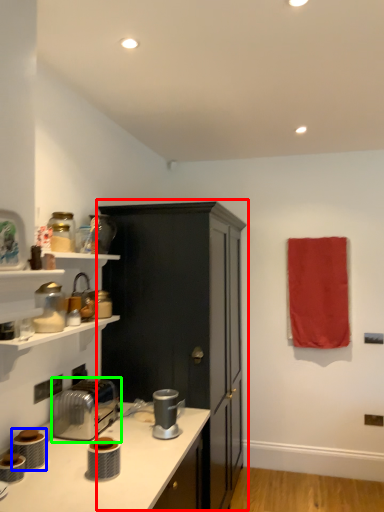
Question: Which is farther away from cabinetry (highlighted by a red box)? appliance (highlighted by a blue box) or toaster (highlighted by a green box)?

Choices:
 (A) appliance
 (B) toaster

Answer: (A)